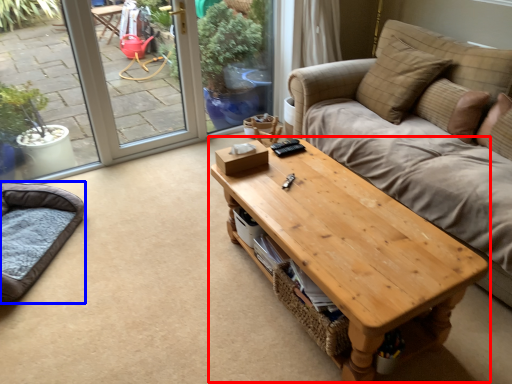
Question: Which point is closer to the camera, coffee table (highlighted by a red box) or cat bed (highlighted by a blue box)?

Choices:
 (A) coffee table
 (B) cat bed

Answer: (A)